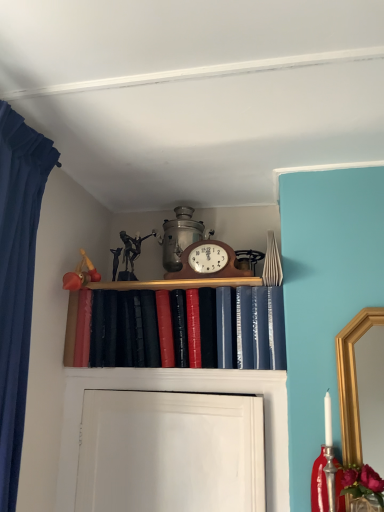
What do you see at coordinates (208, 262) in the screenshot?
I see `wooden clock at center` at bounding box center [208, 262].

Find the location of a particular element. The image size is (384, 512). wooden clock at center is located at coordinates (208, 262).

What is the approximate height of wooden clock at center?

It is 6.89 inches.

Measure the distance between point [211,253] and camera.

1.81 meters.

Image resolution: width=384 pixels, height=512 pixels. What do you see at coordinates (117, 329) in the screenshot?
I see `shiny leather book at center` at bounding box center [117, 329].

The height and width of the screenshot is (512, 384). I want to click on shiny leather book at center, so click(x=117, y=329).

Locate an element on the screen. The image size is (384, 512). wooden clock at center is located at coordinates (208, 262).

Is shiny leather book at center at the right side of wooden clock at center?

No, shiny leather book at center is not to the right of wooden clock at center.

Which object is further away from the camera, shiny leather book at center or wooden clock at center?

wooden clock at center is further from the camera.

Between point (135, 288) and point (211, 275), which one is positioned behind?

The point (135, 288) is farther from the camera.

From the image's perspective, is shiny leather book at center over wooden clock at center?

No.

From a real-world perspective, who is located higher, shiny leather book at center or wooden clock at center?

In real-world perspective, wooden clock at center is above.

Which object is wider, shiny leather book at center or wooden clock at center?

shiny leather book at center is wider.

Who is taller, shiny leather book at center or wooden clock at center?

shiny leather book at center is taller.

Considering the relative sizes of shiny leather book at center and wooden clock at center in the image provided, is shiny leather book at center bigger than wooden clock at center?

Yes.

Would you say shiny leather book at center contains wooden clock at center?

Actually, wooden clock at center is outside shiny leather book at center.

Is shiny leather book at center in contact with wooden clock at center?

No, shiny leather book at center is not with wooden clock at center.

From the picture: Is shiny leather book at center turned away from wooden clock at center?

That's not correct — shiny leather book at center is not looking away from wooden clock at center.

Can you tell me how much shiny leather book at center and wooden clock at center differ in facing direction?

They differ by 0.00558 degrees in their facing directions.

Image resolution: width=384 pixels, height=512 pixels. I want to click on alarm clock above the shiny leather book at center (from a real-world perspective), so (x=208, y=262).

Between wooden clock at center and shiny leather book at center, which one appears on the right side from the viewer's perspective?

wooden clock at center.

Which object is further away from the camera, wooden clock at center or shiny leather book at center?

wooden clock at center is behind.

In the scene shown: Which is more distant, (214, 258) or (239, 358)?

The point (214, 258) is more distant.

From the image's perspective, is wooden clock at center on shiny leather book at center?

Correct, wooden clock at center appears higher than shiny leather book at center in the image.

From a real-world perspective, does wooden clock at center sit lower than shiny leather book at center?

No, from a real-world perspective, wooden clock at center is not beneath shiny leather book at center.

Is wooden clock at center wider or thinner than shiny leather book at center?

Considering their sizes, wooden clock at center looks slimmer than shiny leather book at center.

Considering the sizes of objects wooden clock at center and shiny leather book at center in the image provided, who is taller, wooden clock at center or shiny leather book at center?

With more height is shiny leather book at center.

Is wooden clock at center bigger than shiny leather book at center?

No, wooden clock at center is not bigger than shiny leather book at center.

From the picture: Is wooden clock at center inside the boundaries of shiny leather book at center, or outside?

wooden clock at center exists outside the volume of shiny leather book at center.

Are wooden clock at center and shiny leather book at center far apart?

No, wooden clock at center is in close proximity to shiny leather book at center.

Could you tell me if wooden clock at center is turned towards shiny leather book at center?

No, wooden clock at center does not turn towards shiny leather book at center.

Based on the photo, what's the angular difference between wooden clock at center and shiny leather book at center's facing directions?

wooden clock at center and shiny leather book at center are facing 0.00558 degrees away from each other.

The height and width of the screenshot is (512, 384). I want to click on book that is under the wooden clock at center (from a real-world perspective), so click(x=117, y=329).

The image size is (384, 512). What are the coordinates of `book located below the wooden clock at center (from the image's perspective)` in the screenshot? It's located at (117, 329).

This screenshot has height=512, width=384. Identify the location of alarm clock above the shiny leather book at center (from the image's perspective). (208, 262).